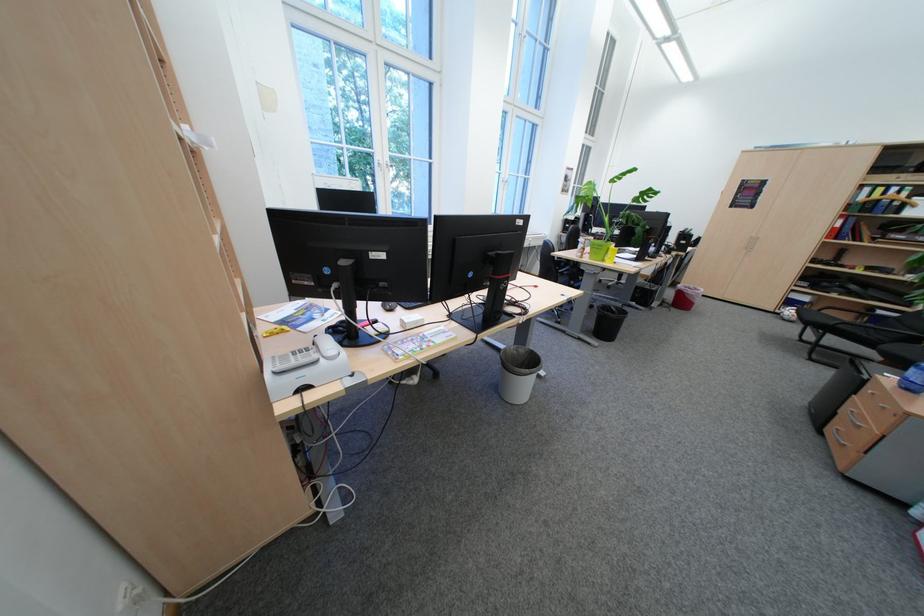
Where would you lift the lime green pot? Please return your answer as a coordinate pair (x, y).

(614, 207)